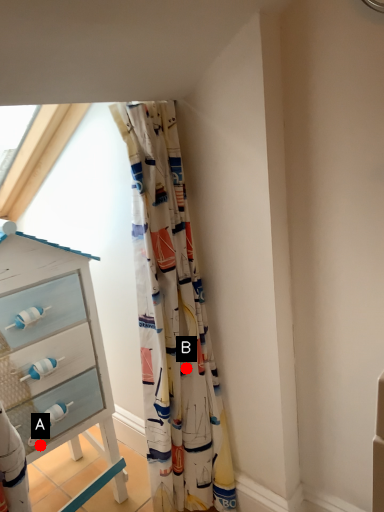
Question: Two points are circled on the image, labeled by A and B beside each circle. Which of the following is the farthest from the observer?

Choices:
 (A) A is further
 (B) B is further

Answer: (B)